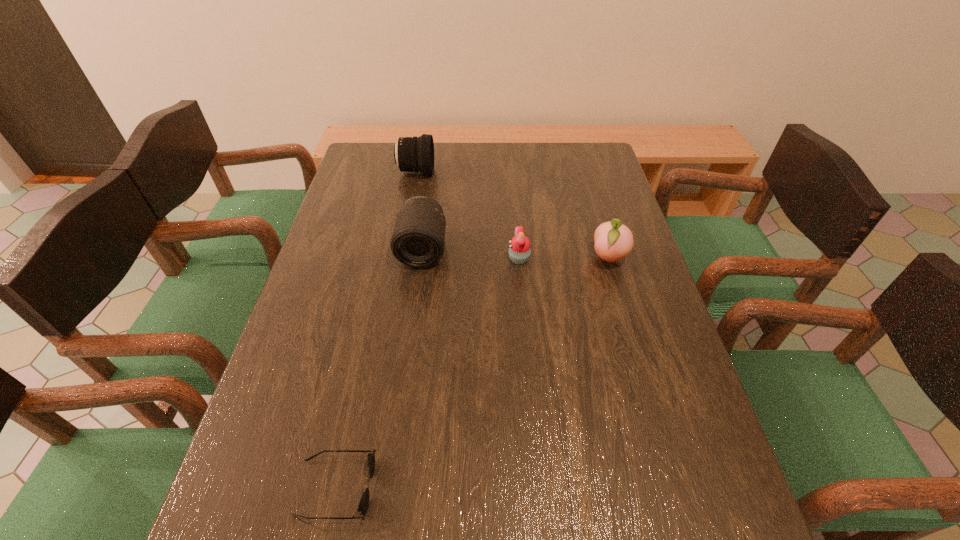
This screenshot has height=540, width=960. I want to click on vacant space located 0.090m on the face of the fourth object from left to right, so click(475, 259).

Image resolution: width=960 pixels, height=540 pixels. I want to click on free space located 0.150m on the face of the fourth object from left to right, so click(454, 259).

Locate an element on the screen. The image size is (960, 540). vacant area located on the face of the fourth object from left to right is located at coordinates (440, 259).

At what (x,y) coordinates should I click in order to perform the action: click on vacant space located 0.090m on the front-facing side of the shortest object. Please return your answer as a coordinate pair (x, y). The image size is (960, 540). Looking at the image, I should click on (422, 488).

Locate an element on the screen. Image resolution: width=960 pixels, height=540 pixels. object located in the far edge section of the desktop is located at coordinates (416, 154).

Locate an element on the screen. Image resolution: width=960 pixels, height=540 pixels. object that is at the left edge is located at coordinates pyautogui.click(x=364, y=502).

The image size is (960, 540). Find the location of `object positioned at the right edge`. object positioned at the right edge is located at coordinates click(613, 241).

Where is `free location at the far edge of the desktop`? Image resolution: width=960 pixels, height=540 pixels. free location at the far edge of the desktop is located at coordinates [463, 171].

In the image, there is a desktop. At what (x,y) coordinates should I click in order to perform the action: click on vacant space at the near edge. Please return your answer as a coordinate pair (x, y). This screenshot has height=540, width=960. Looking at the image, I should click on (587, 539).

In the image, there is a desktop. Identify the location of vacant region at the left edge. (311, 334).